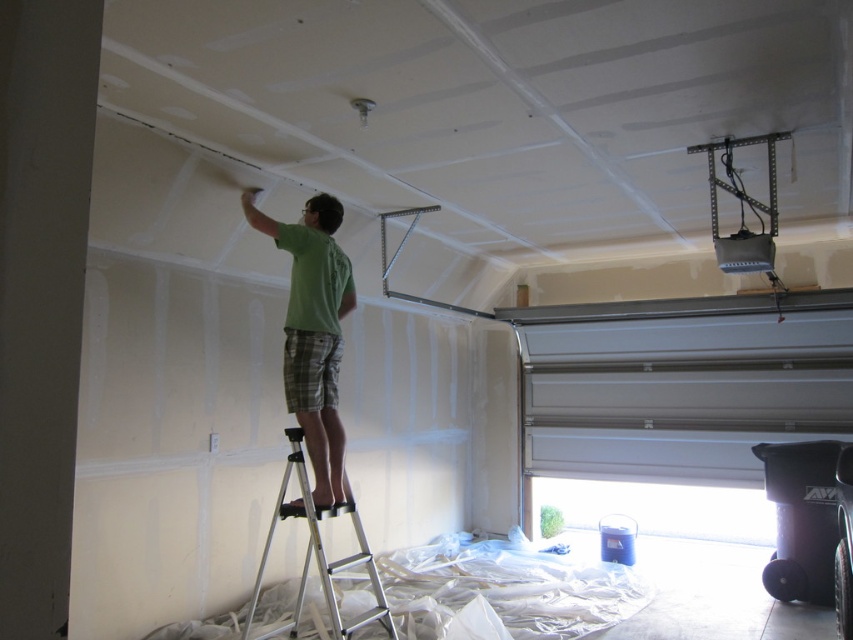
You are a contractor in the garage and need to access the ladder. Which object is closer to you, the silver metallic garage door at lower right or the silver metallic ladder at center?

The silver metallic ladder at center is behind the silver metallic garage door at lower right, so the garage door is closer to you.

You are a contractor assessing the garage renovation. You notice the green cotton shirt at upper center and the silver metallic ladder at center. Which object takes up more physical space in the scene?

The silver metallic ladder at center takes up more physical space than the green cotton shirt at upper center because the green cotton shirt at upper center occupies less space than silver metallic ladder at center.

You are standing in the garage and want to move from the first point to the second point. Which direction should you move to go from point (328, 388) to point (300, 458)?

To move from point (328, 388) to point (300, 458), you should move forward because point (328, 388) is behind point (300, 458).